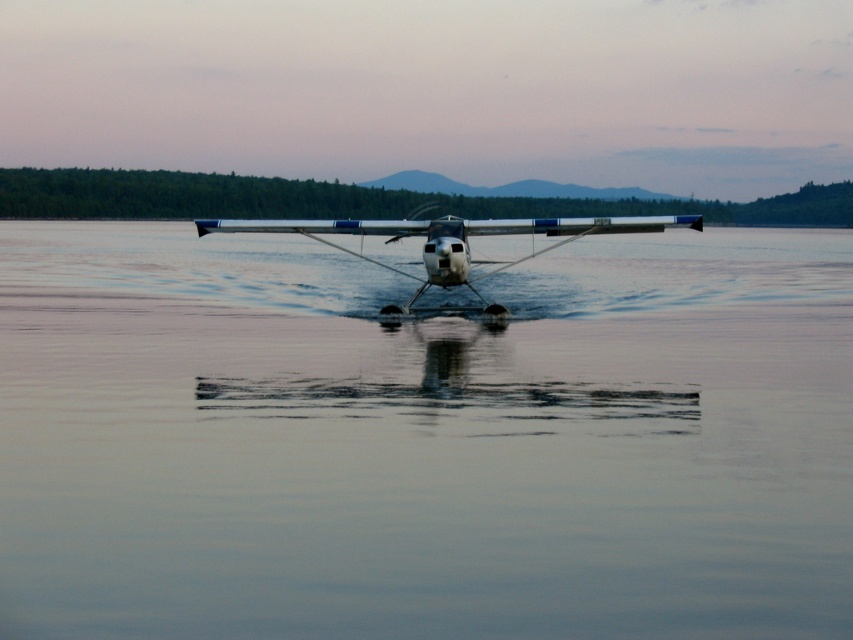
Looking at this image, is smooth water at center above white glossy seaplane at center?

Actually, smooth water at center is below white glossy seaplane at center.

Can you confirm if smooth water at center is smaller than white glossy seaplane at center?

No, smooth water at center is not smaller than white glossy seaplane at center.

Between point (107, 460) and point (490, 269), which one is positioned behind?

The point (490, 269) is behind.

Locate an element on the screen. smooth water at center is located at coordinates (422, 440).